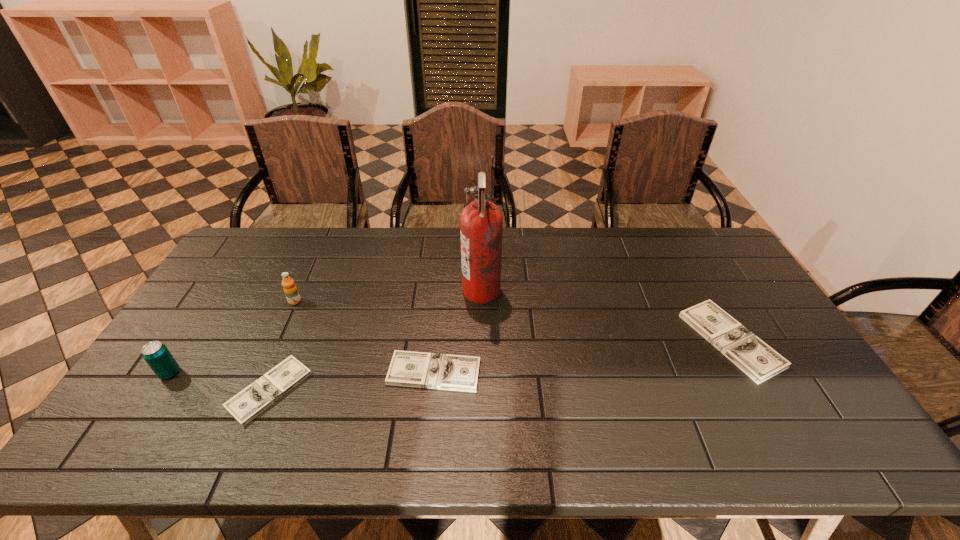
I want to click on spot to insert another dollar for uniform distribution, so click(588, 356).